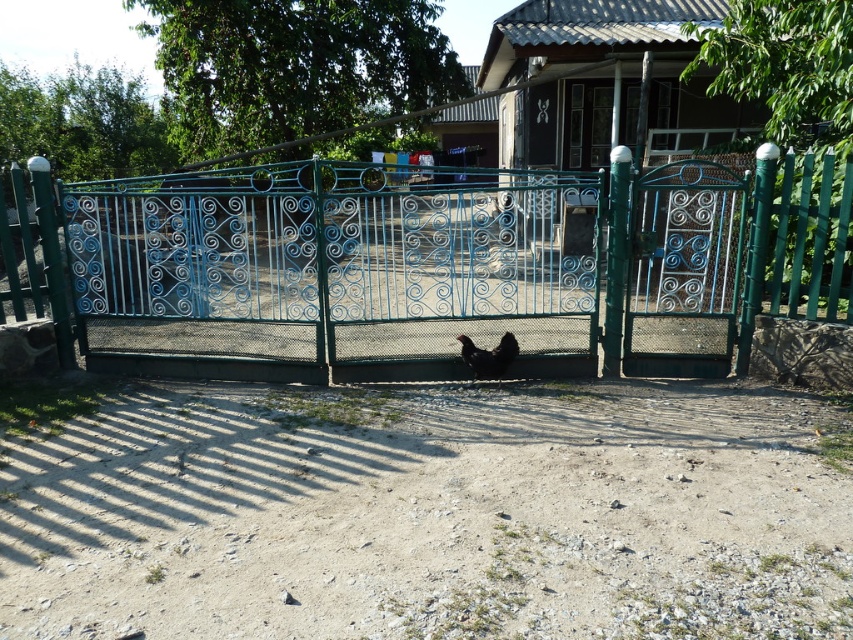
Based on the photo, who is higher up, green wrought iron gate at center or black matte chicken at center?

green wrought iron gate at center is higher up.

Can you confirm if green wrought iron gate at center is positioned to the right of black matte chicken at center?

Indeed, green wrought iron gate at center is positioned on the right side of black matte chicken at center.

Who is more distant from viewer, (556,225) or (486,355)?

Positioned behind is point (556,225).

This screenshot has height=640, width=853. Find the location of `green wrought iron gate at center`. green wrought iron gate at center is located at coordinates (451, 266).